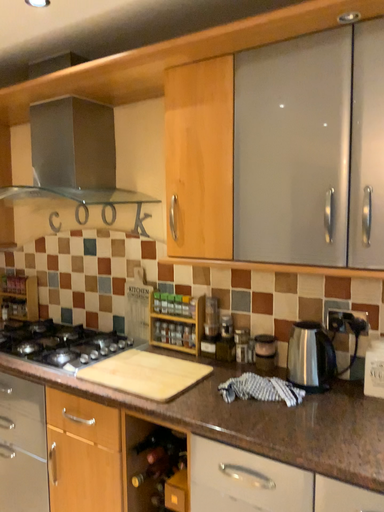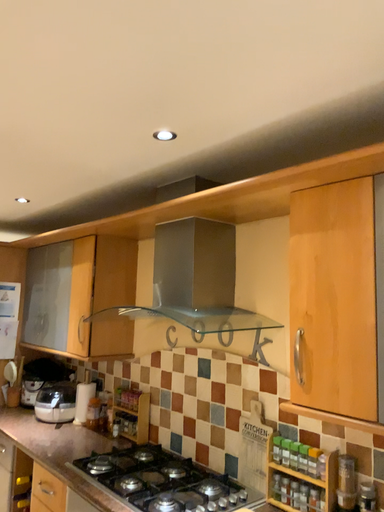
Question: How did the camera likely rotate when shooting the video?

Choices:
 (A) rotated left
 (B) rotated right

Answer: (A)